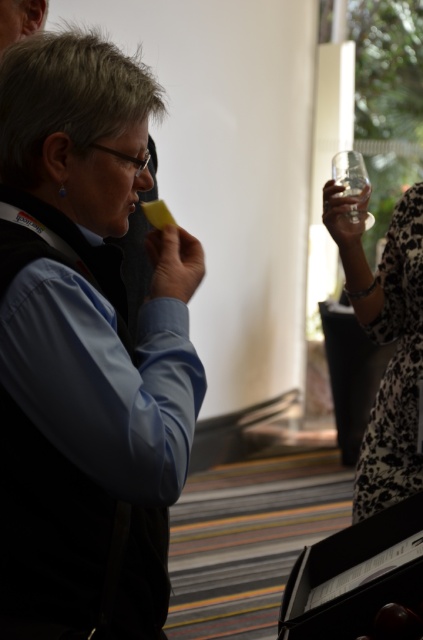
You are standing in the room and want to locate the matte black vest at center. Which coordinate point should you look at?

You should look at the coordinate point at (85, 349) to find the matte black vest at center.

You are at a party and need to pour a drink. You see a transparent glass at upper right and a clear plastic cup at upper right. Which one can hold more liquid?

The transparent glass at upper right is bigger than the clear plastic cup at upper right, so it can hold more liquid.

You are at a party and want to grab a drink from the transparent glass at upper right. However, there is a matte black vest at center in the way. Can you reach the glass without moving the vest?

The matte black vest at center is below the transparent glass at upper right, so you can reach the glass without moving the vest because it is positioned above the vest.